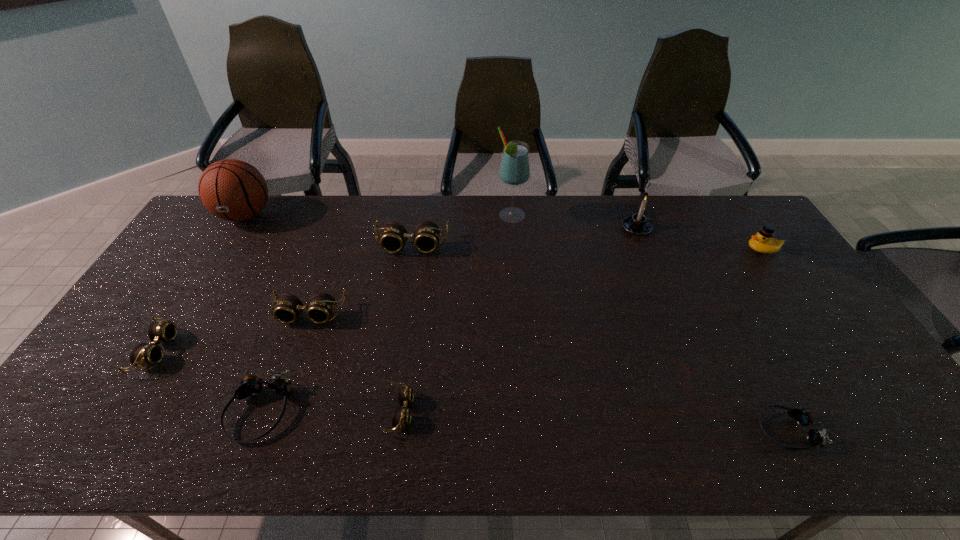
I want to click on vacant space at the near edge of the desktop, so click(612, 439).

In the image, there is a desktop. Identify the location of vacant area at the right edge. (795, 283).

You are a GUI agent. You are given a task and a screenshot of the screen. Output one action in this format:
    pyautogui.click(x=<x>, y=<y>)
    Task: Click on the free location at the far right corner of the desktop
    The width and height of the screenshot is (960, 540).
    Given the screenshot: What is the action you would take?
    pyautogui.click(x=745, y=227)

Locate an element on the screen. The height and width of the screenshot is (540, 960). empty location between the smallest brown goggles and the farthest goggles is located at coordinates (406, 329).

You are a GUI agent. You are given a task and a screenshot of the screen. Output one action in this format:
    pyautogui.click(x=<x>, y=<y>)
    Task: Click on the empty space that is in between the orange basketball and the bigger bronze goggles
    This screenshot has height=540, width=960.
    Given the screenshot: What is the action you would take?
    pyautogui.click(x=252, y=313)

Locate an element on the screen. Image resolution: width=960 pixels, height=540 pixels. free spot between the right bronze goggles and the farthest goggles is located at coordinates (599, 338).

Locate an element on the screen. vacant point located between the second brown goggles from left to right and the eighth object from left to right is located at coordinates (473, 271).

Locate an element on the screen. vacant space that is in between the leftmost goggles and the eighth shortest object is located at coordinates (396, 289).

Find the location of `unoccupied area between the farthest brown goggles and the right bronze goggles`. unoccupied area between the farthest brown goggles and the right bronze goggles is located at coordinates (599, 338).

What are the coordinates of `unoccupied position between the third tallest object and the yellow duck` in the screenshot? It's located at (700, 239).